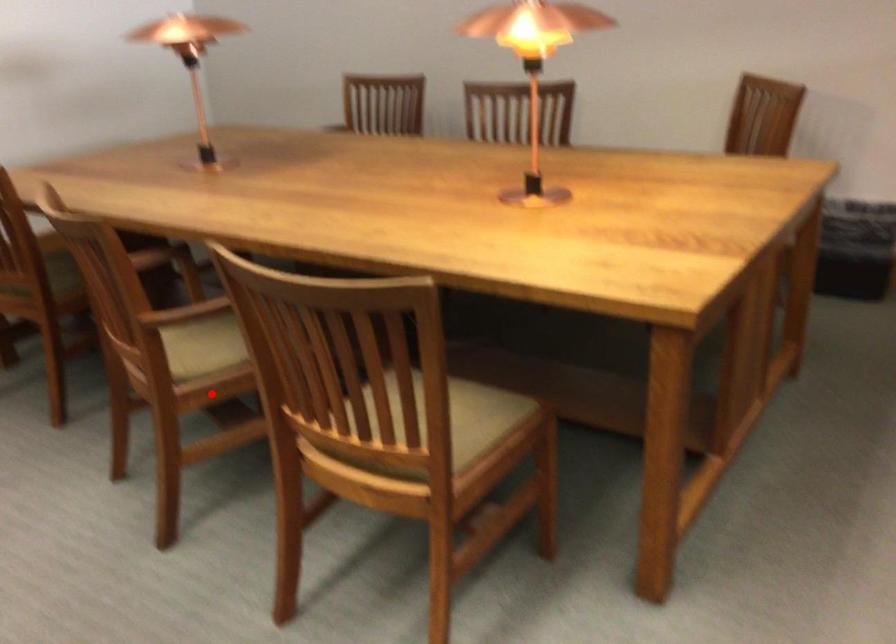
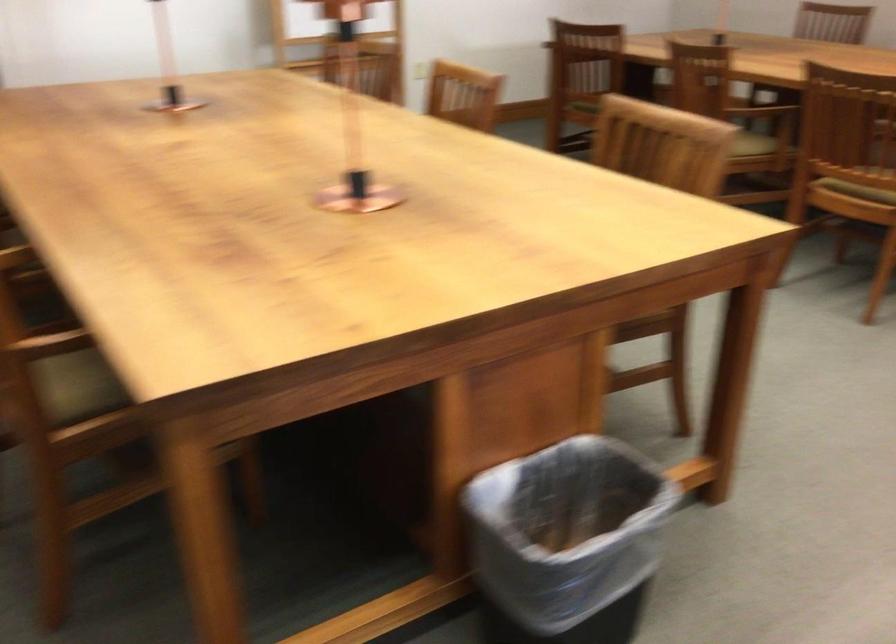
Locate, in the second image, the point that corresponds to the highlighted location in the first image.

(753, 144)